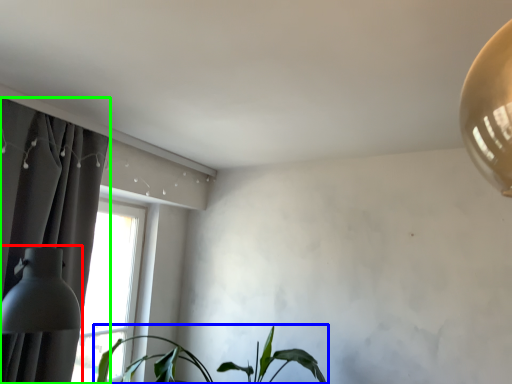
Question: Which object is positioned closest to table lamp (highlighted by a red box)? Select from houseplant (highlighted by a blue box) and curtain (highlighted by a green box).

Choices:
 (A) houseplant
 (B) curtain

Answer: (B)